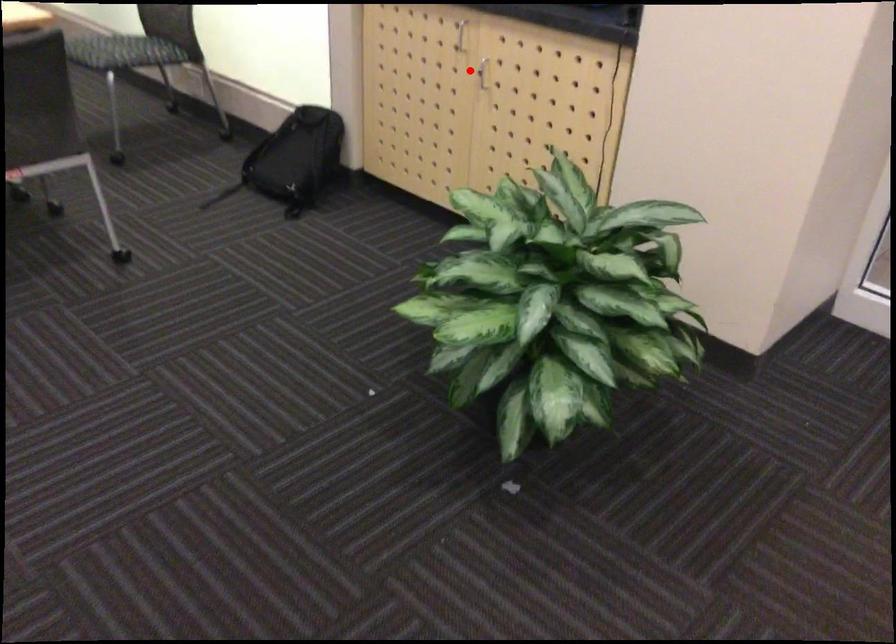
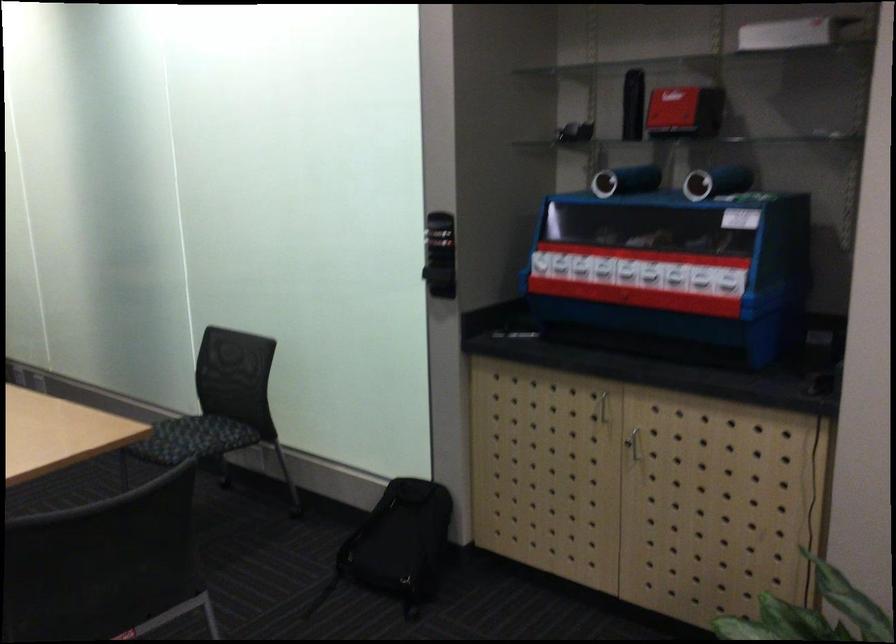
Question: I am providing you with two images of the same scene from different viewpoints. A red point is shown in image1. For the corresponding object point in image2, is it positioned nearer or farther from the camera?

Choices:
 (A) Nearer
 (B) Farther

Answer: (A)